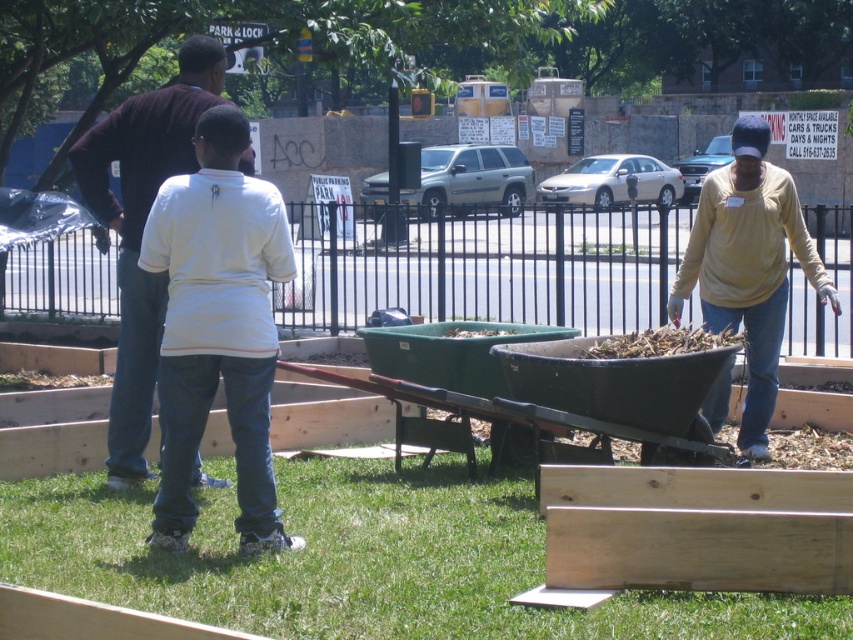
Who is more distant from viewer, (x=91, y=154) or (x=740, y=166)?

The point (x=740, y=166) is more distant.

Does point (160, 332) come in front of point (817, 256)?

Yes, point (160, 332) is in front of point (817, 256).

Where is `dark brown sweater at left`? This screenshot has height=640, width=853. dark brown sweater at left is located at coordinates (142, 228).